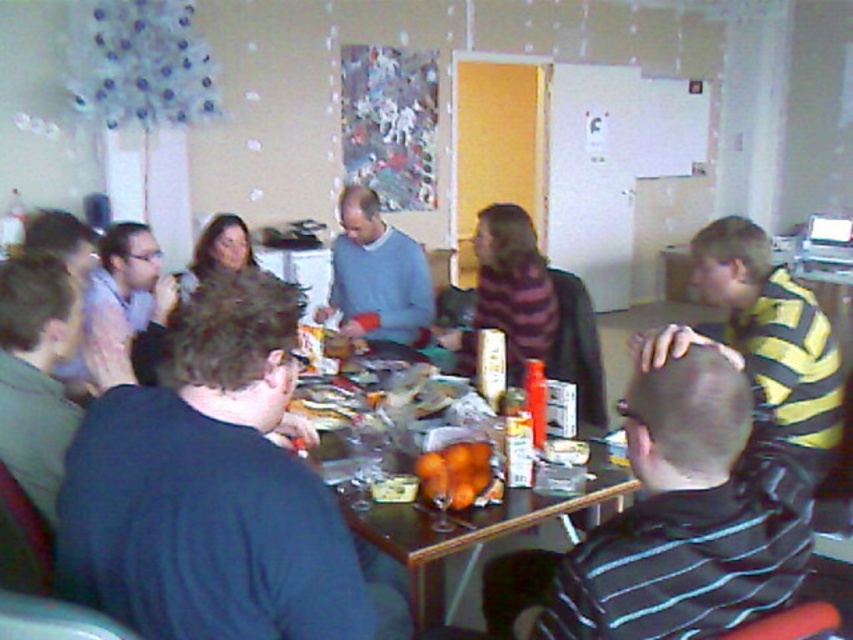
Which is above, dark blue shirt at left or dark blue sweater at left?

dark blue sweater at left is above.

Can you confirm if dark blue shirt at left is wider than dark blue sweater at left?

Correct, the width of dark blue shirt at left exceeds that of dark blue sweater at left.

Does point (248, 548) lie behind point (59, 433)?

No, (248, 548) is closer to viewer.

Where is `dark blue shirt at left`? The height and width of the screenshot is (640, 853). dark blue shirt at left is located at coordinates (213, 492).

Between wooden table at center and matte black sweater at center, which one has less height?

wooden table at center is shorter.

Can you confirm if wooden table at center is smaller than matte black sweater at center?

No, wooden table at center is not smaller than matte black sweater at center.

Where is `wooden table at center`? The image size is (853, 640). wooden table at center is located at coordinates (471, 528).

Who is lower down, wooden table at center or striped sweater at center?

wooden table at center is below.

Can you confirm if wooden table at center is taller than striped sweater at center?

Incorrect, wooden table at center's height is not larger of striped sweater at center's.

Does point (585, 486) come in front of point (498, 282)?

Yes, point (585, 486) is closer to viewer.

Identify the location of wooden table at center. (471, 528).